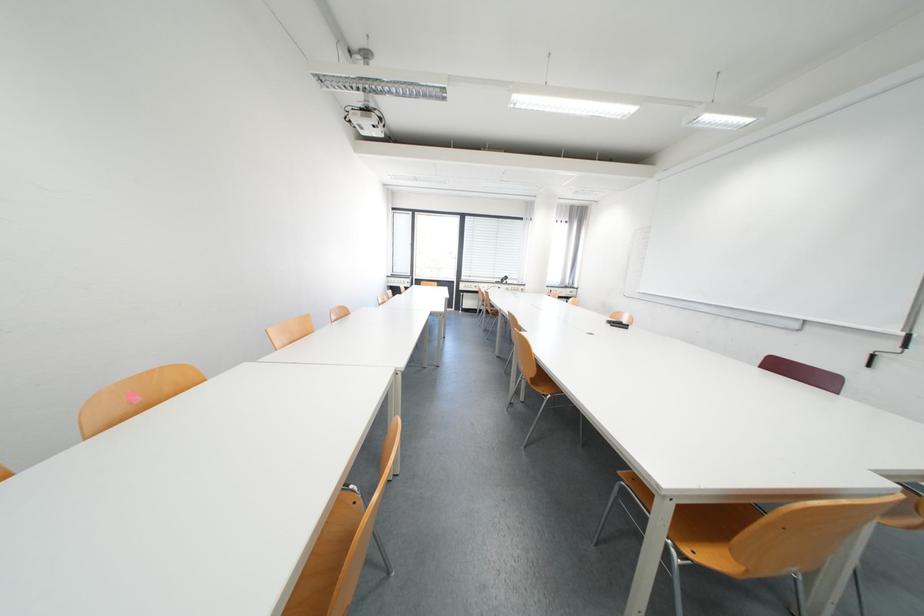
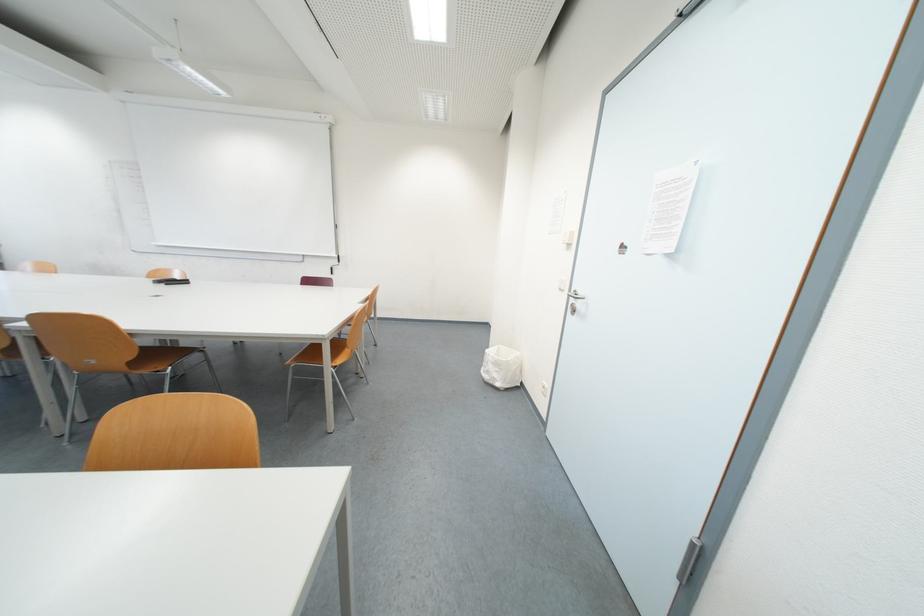
The first image is from the beginning of the video and the second image is from the end. How did the camera likely rotate when shooting the video?

The rotation direction of the camera is right-down.